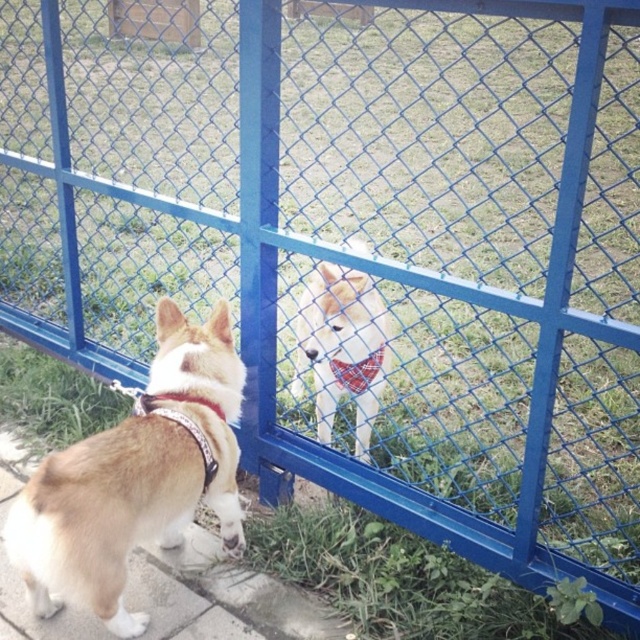
You are standing at the entrance of the dog park and see two points marked in the image. One is at coordinates point [129,540] and the other at point [376,349]. Which point is closer to you?

Point [129,540] is in front of point [376,349], so it is closer to you.

You are a dog owner trying to determine if your brown fur dog at left can fit through the space between the plaid fabric neckband at center and the fence. Based on the scene description, can the dog pass through that space?

The brown fur dog at left might be wider than plaid fabric neckband at center, so there is a risk that the dog cannot fit through the space between the plaid fabric neckband at center and the fence.